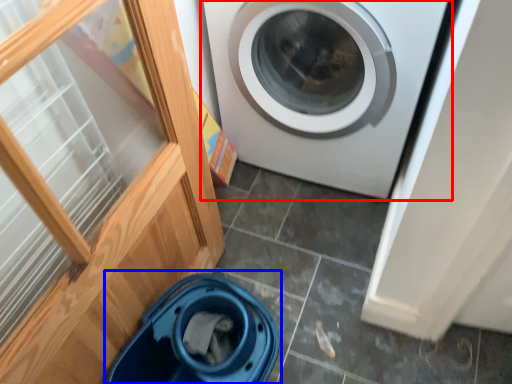
Question: Which object appears farthest to the camera in this image, washing machine (highlighted by a red box) or dish washer (highlighted by a blue box)?

Choices:
 (A) washing machine
 (B) dish washer

Answer: (A)